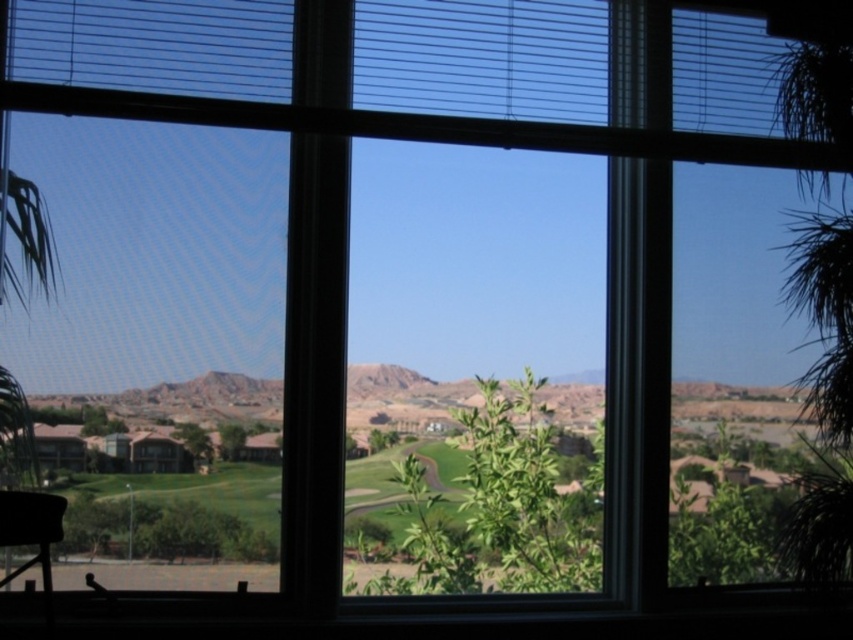
Question: Does desert sandstone mountain at center have a greater width compared to matte black chair at lower left?

Choices:
 (A) no
 (B) yes

Answer: (B)

Question: Can you confirm if desert sandstone mountain at center is positioned to the left of matte black chair at lower left?

Choices:
 (A) yes
 (B) no

Answer: (B)

Question: Does desert sandstone mountain at center appear on the left side of matte black chair at lower left?

Choices:
 (A) yes
 (B) no

Answer: (B)

Question: Which point is farther to the camera?

Choices:
 (A) matte black chair at lower left
 (B) desert sandstone mountain at center

Answer: (B)